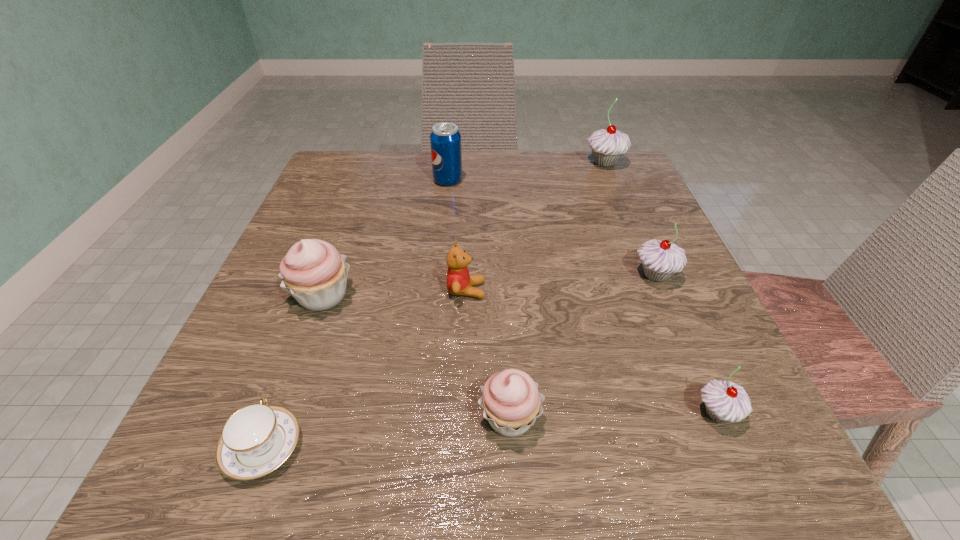
At what (x,y) coordinates should I click in order to perform the action: click on gray cupcake identified as the second closest to the farthest gray cupcake. Please return your answer as a coordinate pair (x, y). The height and width of the screenshot is (540, 960). Looking at the image, I should click on (724, 401).

Image resolution: width=960 pixels, height=540 pixels. Find the location of `vacant region that satisfies the following two spatial constraints: 1. on the front-facing side of the right pink cupcake; 2. on the right side of the red teddy bear`. vacant region that satisfies the following two spatial constraints: 1. on the front-facing side of the right pink cupcake; 2. on the right side of the red teddy bear is located at coordinates pyautogui.click(x=462, y=417).

The height and width of the screenshot is (540, 960). What are the coordinates of `vacant space that satisfies the following two spatial constraints: 1. on the side with the handle of the teacup; 2. on the right side of the nearer pink cupcake` in the screenshot? It's located at (274, 417).

The image size is (960, 540). Identify the location of free space in the image that satisfies the following two spatial constraints: 1. on the back side of the blue pop soda; 2. on the left side of the farthest gray cupcake. (449, 163).

Locate an element on the screen. This screenshot has height=540, width=960. free region that satisfies the following two spatial constraints: 1. on the side with the handle of the tallest object; 2. on the right side of the teacup is located at coordinates (369, 163).

You are a GUI agent. You are given a task and a screenshot of the screen. Output one action in this format:
    pyautogui.click(x=<x>, y=<y>)
    Task: Click on the blank space that satisfies the following two spatial constraints: 1. on the side with the handle of the nearest gray cupcake; 2. on the right side of the teacup
    This screenshot has height=540, width=960.
    Given the screenshot: What is the action you would take?
    pyautogui.click(x=276, y=413)

The height and width of the screenshot is (540, 960). In order to click on vacant space that satisfies the following two spatial constraints: 1. on the front side of the tallest cupcake; 2. on the left side of the smallest gray cupcake in this screenshot , I will do `click(709, 413)`.

This screenshot has width=960, height=540. I want to click on blank space that satisfies the following two spatial constraints: 1. on the front side of the farthest gray cupcake; 2. on the right side of the second smallest gray cupcake, so click(x=652, y=275).